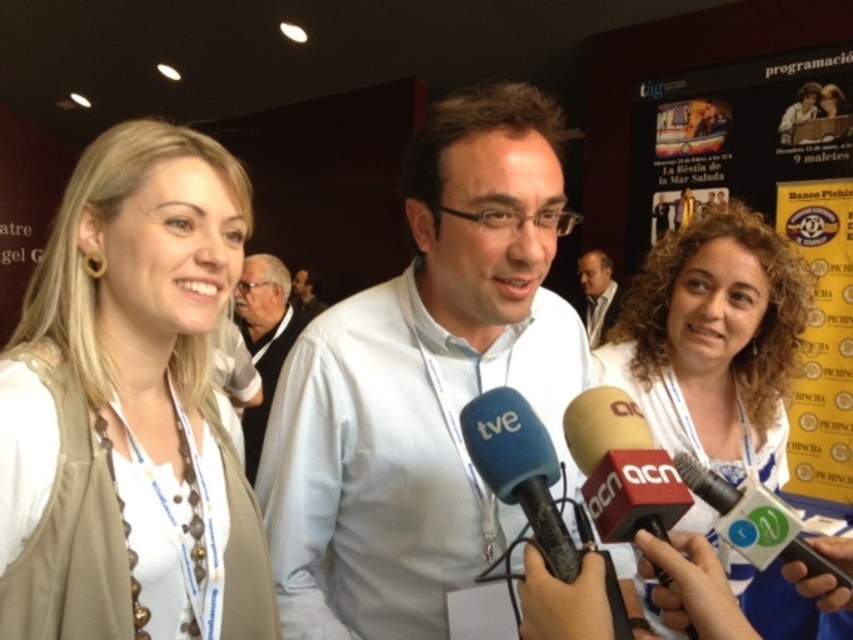
You are a photographer at the event and need to position a backdrop behind the beige fabric vest at left and the white fabric vest at center. If the backdrop can only accommodate the narrower of the two, which vest should you place it behind?

The beige fabric vest at left is narrower than the white fabric vest at center, so the backdrop should be placed behind the beige fabric vest at left.

In the scene shown: You are a photographer at the event and need to adjust the camera focus. Since the beige fabric vest at left and the dark brown leather jacket at center are in the frame, which one should you focus on first if you want to ensure the taller object is in focus?

The beige fabric vest at left is much taller than the dark brown leather jacket at center, so you should focus on the beige fabric vest at left first to ensure the taller object is in focus.